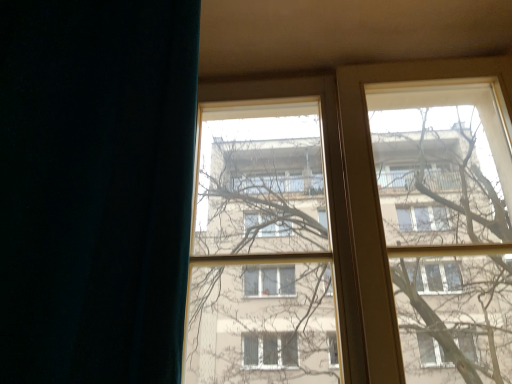
I want to click on transparent glass window at center, so click(x=364, y=192).

The height and width of the screenshot is (384, 512). What do you see at coordinates (364, 192) in the screenshot? I see `transparent glass window at center` at bounding box center [364, 192].

Locate an element on the screen. This screenshot has height=384, width=512. transparent glass window at center is located at coordinates click(x=364, y=192).